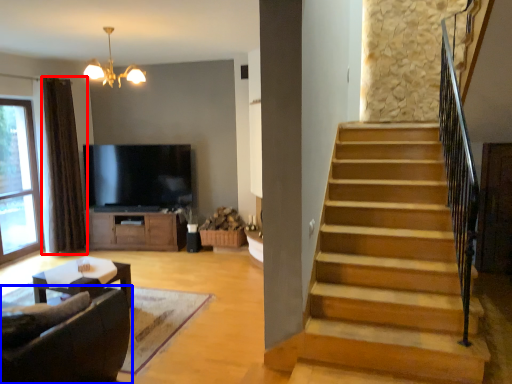
Question: Which of the following is the closest to the observer, curtain (highlighted by a red box) or studio couch (highlighted by a blue box)?

Choices:
 (A) curtain
 (B) studio couch

Answer: (B)